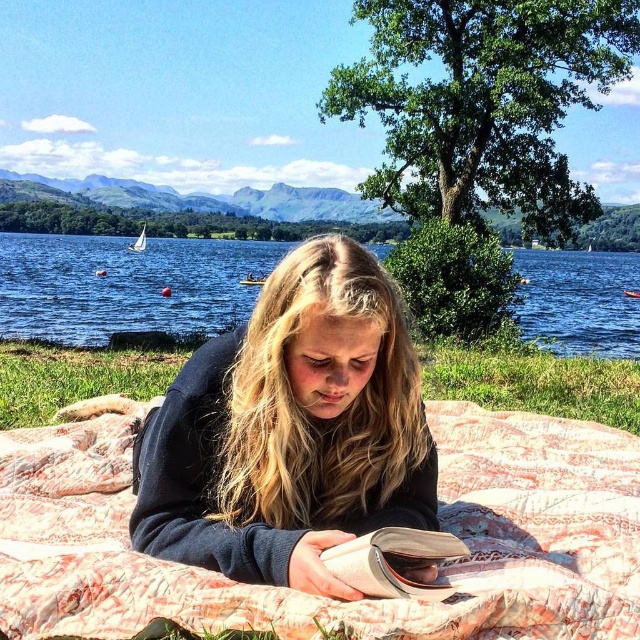
Does dark blue sweater at center have a lesser width compared to green grass at center?

Yes.

Who is more forward, (x=368, y=435) or (x=545, y=371)?

Positioned in front is point (x=368, y=435).

You are a GUI agent. You are given a task and a screenshot of the screen. Output one action in this format:
    pyautogui.click(x=<x>, y=<y>)
    Task: Click on the dark blue sweater at center
    The image size is (640, 640).
    Given the screenshot: What is the action you would take?
    pyautogui.click(x=291, y=429)

Can you confirm if pink quilted blanket at center is positioned to the right of blue water at center?

Correct, you'll find pink quilted blanket at center to the right of blue water at center.

Does pink quilted blanket at center appear under blue water at center?

Indeed, pink quilted blanket at center is positioned under blue water at center.

Is point (582, 468) more distant than point (168, 280)?

No.

The image size is (640, 640). Find the location of `pink quilted blanket at center`. pink quilted blanket at center is located at coordinates (323, 596).

Can you confirm if pink quilted blanket at center is bigger than beige textured book at lower center?

Indeed, pink quilted blanket at center has a larger size compared to beige textured book at lower center.

What are the coordinates of `pink quilted blanket at center` in the screenshot? It's located at (323, 596).